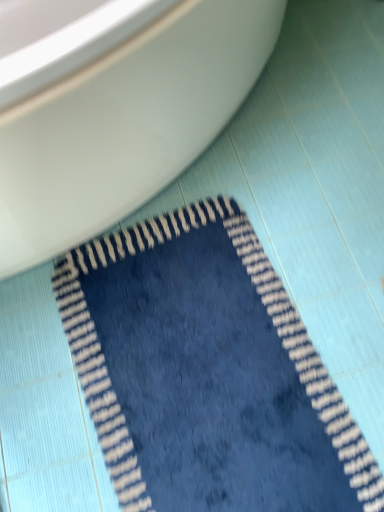
Question: Is navy blue plush rug at lower center looking in the opposite direction of white glossy toilet at upper left?

Choices:
 (A) no
 (B) yes

Answer: (A)

Question: Are navy blue plush rug at lower center and white glossy toilet at upper left far apart?

Choices:
 (A) no
 (B) yes

Answer: (A)

Question: Does navy blue plush rug at lower center have a lesser width compared to white glossy toilet at upper left?

Choices:
 (A) yes
 (B) no

Answer: (A)

Question: Considering the relative sizes of navy blue plush rug at lower center and white glossy toilet at upper left in the image provided, is navy blue plush rug at lower center smaller than white glossy toilet at upper left?

Choices:
 (A) no
 (B) yes

Answer: (B)

Question: Can we say navy blue plush rug at lower center lies outside white glossy toilet at upper left?

Choices:
 (A) no
 (B) yes

Answer: (B)

Question: Considering the relative positions of navy blue plush rug at lower center and white glossy toilet at upper left in the image provided, is navy blue plush rug at lower center to the left of white glossy toilet at upper left from the viewer's perspective?

Choices:
 (A) yes
 (B) no

Answer: (B)

Question: From the image's perspective, does white glossy toilet at upper left appear higher than navy blue plush rug at lower center?

Choices:
 (A) yes
 (B) no

Answer: (A)

Question: Is white glossy toilet at upper left in front of navy blue plush rug at lower center?

Choices:
 (A) yes
 (B) no

Answer: (A)

Question: Can you confirm if white glossy toilet at upper left is wider than navy blue plush rug at lower center?

Choices:
 (A) no
 (B) yes

Answer: (B)

Question: Is navy blue plush rug at lower center surrounded by white glossy toilet at upper left?

Choices:
 (A) yes
 (B) no

Answer: (B)

Question: Can you confirm if white glossy toilet at upper left is thinner than navy blue plush rug at lower center?

Choices:
 (A) yes
 (B) no

Answer: (B)

Question: Does white glossy toilet at upper left touch navy blue plush rug at lower center?

Choices:
 (A) no
 (B) yes

Answer: (A)

Question: Which is correct: white glossy toilet at upper left is inside navy blue plush rug at lower center, or outside of it?

Choices:
 (A) inside
 (B) outside

Answer: (B)